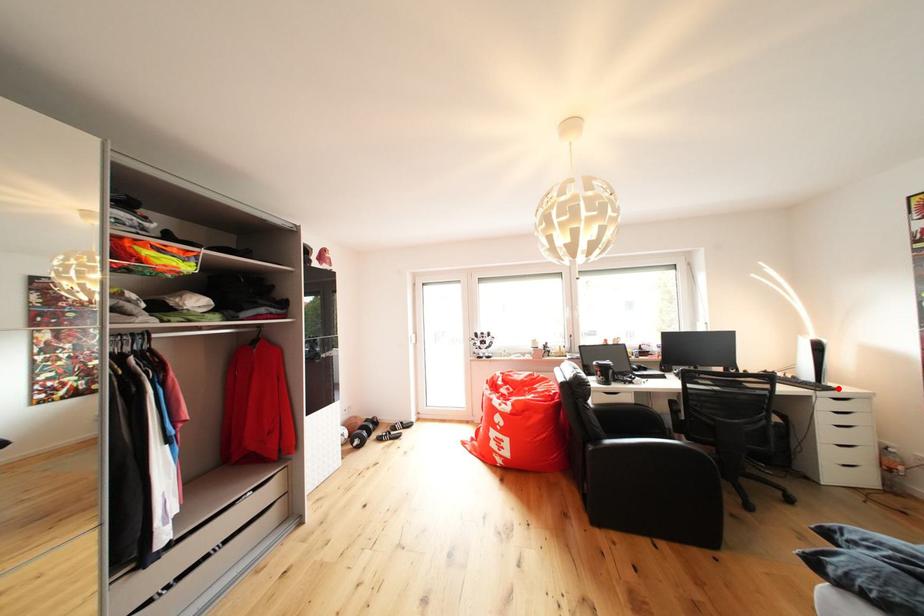
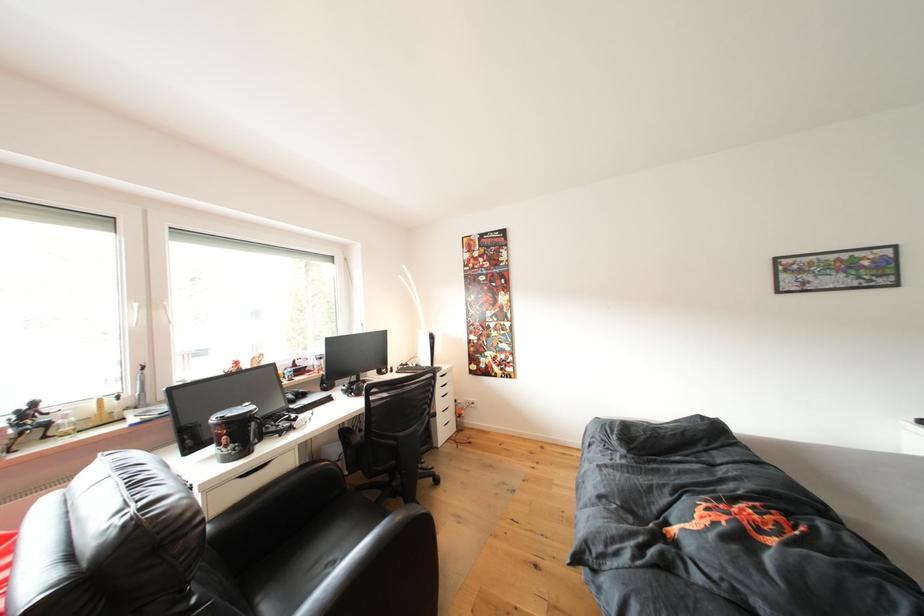
Question: I am providing you with two images of the same scene from different viewpoints. A red point is marked on the first image. At the location where the point appears in image 1, is it still visible in image 2?

Choices:
 (A) Yes
 (B) No

Answer: (A)